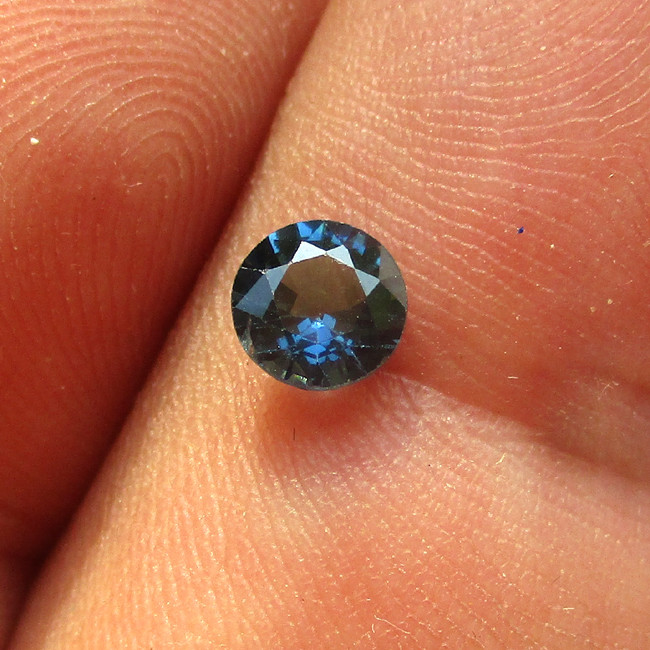
Locate an element on the screen. light is located at coordinates (301, 249).